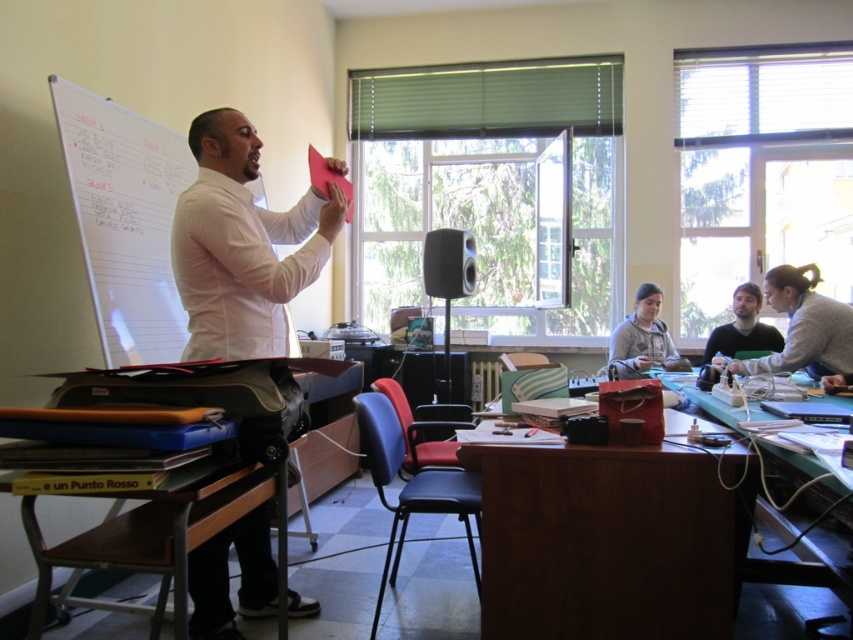
Question: Among these points, which one is nearest to the camera?

Choices:
 (A) coord(96,188)
 (B) coord(816,332)
 (C) coord(285,556)
 (D) coord(463,262)

Answer: (C)

Question: Which point appears farthest from the camera in this image?

Choices:
 (A) (824, 372)
 (B) (144, 180)
 (C) (113, 540)
 (D) (700, 611)

Answer: (A)

Question: Among these points, which one is nearest to the camera?

Choices:
 (A) (648, 369)
 (B) (428, 276)

Answer: (A)

Question: Does gray sweater at lower right come in front of gray fleece sweater at lower center?

Choices:
 (A) no
 (B) yes

Answer: (B)

Question: Observing the image, what is the correct spatial positioning of white matte shirt at center in reference to wooden desk at lower right?

Choices:
 (A) below
 (B) above

Answer: (B)

Question: From the image, what is the correct spatial relationship of white paperboard at upper left in relation to wooden desk at lower right?

Choices:
 (A) right
 (B) left

Answer: (B)